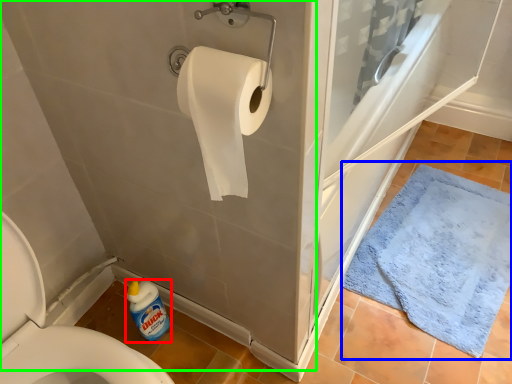
Question: Which object is the closest to the cleaning product (highlighted by a red box)? Choose among these: bath mat (highlighted by a blue box) or bath (highlighted by a green box).

Choices:
 (A) bath mat
 (B) bath

Answer: (B)